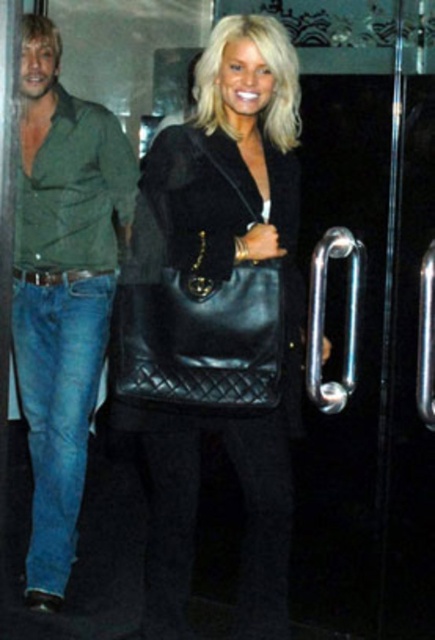
You are a security guard at the building and need to identify the largest object between the green denim jeans at left and the black leather handbag at center. Which one should you report?

The green denim jeans at left is larger in size than the black leather handbag at center, so you should report the green denim jeans at left as the largest object.

You are a security camera monitoring the entrance. You need to determine if the green denim jeans at left is visible below the black leather handbag at center in the image. Can you confirm this?

The green denim jeans at left is positioned under black leather handbag at center, so yes, the green denim jeans at left is visible below the black leather handbag at center in the image.